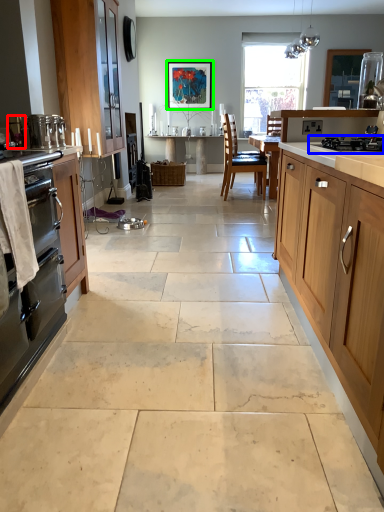
Question: Which is nearer to the appliance (highlighted by a red box)? gas stove (highlighted by a blue box) or picture frame (highlighted by a green box).

Choices:
 (A) gas stove
 (B) picture frame

Answer: (A)